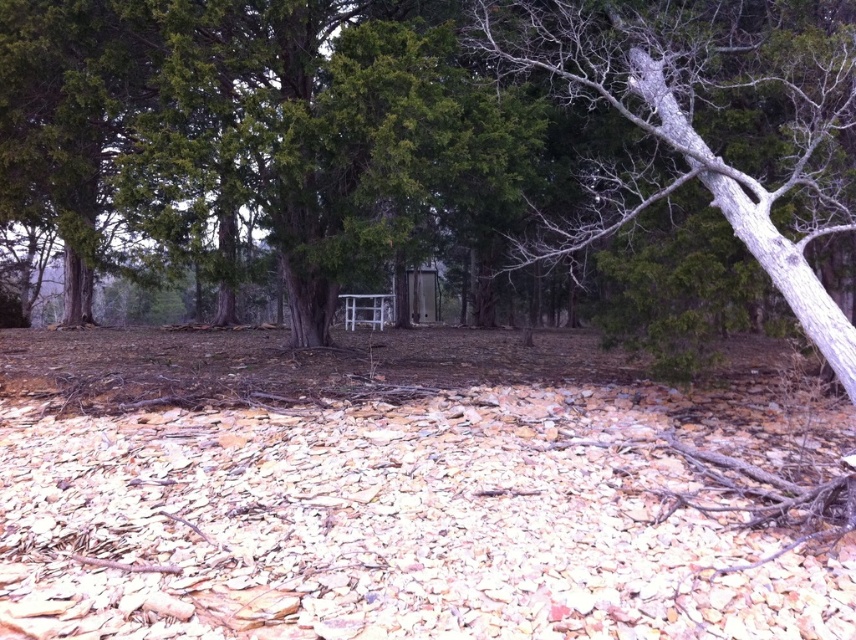
Question: Which of the following is the farthest from the observer?

Choices:
 (A) (840, 621)
 (B) (375, 147)

Answer: (B)

Question: Observing the image, what is the correct spatial positioning of brown dirt field at center in reference to gray bark tree at center?

Choices:
 (A) right
 (B) left

Answer: (B)

Question: Observing the image, what is the correct spatial positioning of green rough bark tree at center in reference to gray bark tree at center?

Choices:
 (A) right
 (B) left

Answer: (B)

Question: Among these objects, which one is farthest from the camera?

Choices:
 (A) green rough bark tree at center
 (B) brown dirt field at center

Answer: (A)

Question: Is green rough bark tree at center thinner than gray bark tree at center?

Choices:
 (A) yes
 (B) no

Answer: (B)

Question: Which of these objects is positioned farthest from the green rough bark tree at center?

Choices:
 (A) gray bark tree at center
 (B) brown dirt field at center

Answer: (B)